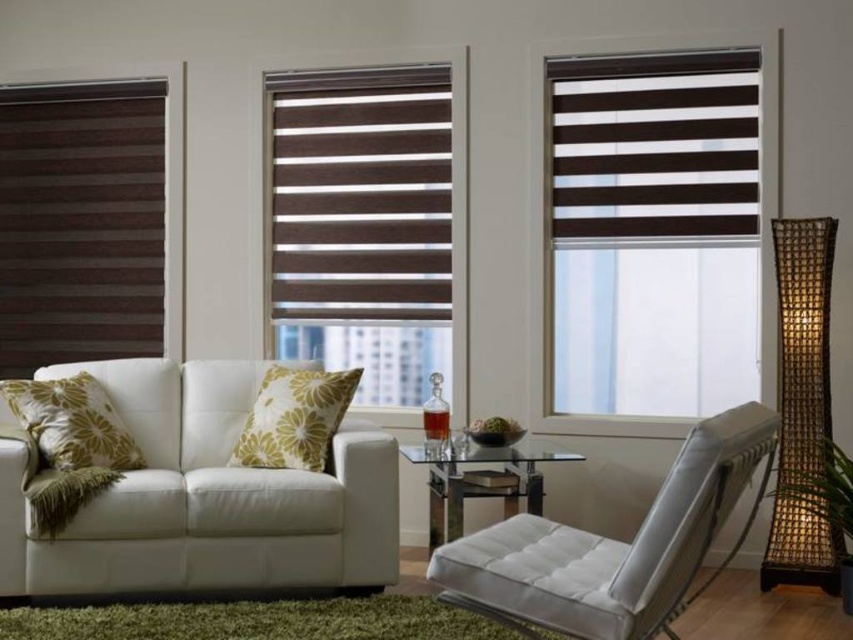
Measure the distance from brown striped roller shade at upper center to brown striped blind at upper right.

They are 4.59 inches apart.

Does point (757, 124) come in front of point (672, 90)?

Yes, it is.

Is point (723, 252) positioned in front of point (602, 195)?

Yes, point (723, 252) is in front of point (602, 195).

The height and width of the screenshot is (640, 853). Identify the location of brown striped roller shade at upper center. (651, 230).

Who is lower down, white leather couch at lower left or brown matte blind at center?

Positioned lower is white leather couch at lower left.

Who is more distant from viewer, (236, 582) or (392, 161)?

The point (392, 161) is more distant.

Is point (99, 528) positioned behind point (323, 129)?

No, it is in front of (323, 129).

Where is `white leather couch at lower left`? The height and width of the screenshot is (640, 853). white leather couch at lower left is located at coordinates (206, 499).

Does brown matte blind at center have a greater width compared to yellow floral fabric pillow at center?

Yes, brown matte blind at center is wider than yellow floral fabric pillow at center.

Can you confirm if brown matte blind at center is thinner than yellow floral fabric pillow at center?

No, brown matte blind at center is not thinner than yellow floral fabric pillow at center.

Where is `brown matte blind at center`? This screenshot has width=853, height=640. brown matte blind at center is located at coordinates (360, 195).

Identify the location of brown matte blind at center. The width and height of the screenshot is (853, 640). (360, 195).